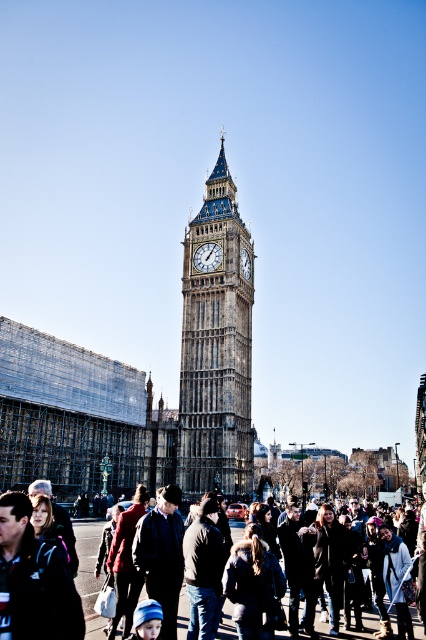
You are a photographer standing in front of the Elizabeth Tower. You want to take a photo that includes both the stone clock tower at center and the dark brown leather jacket at lower center. Which object will appear larger in the photo?

The stone clock tower at center will appear larger in the photo because it has a greater height compared to the dark brown leather jacket at lower center.

You are a photographer standing in front of Big Ben. You want to take a photo that includes both the dark brown leather jacket at lower center and the gold textured clock at center. Which object should you adjust your camera angle to include first if you need to ensure both are fully visible?

The dark brown leather jacket at lower center is wider than the gold textured clock at center, so you should adjust your camera angle to include the dark brown leather jacket at lower center first to ensure both are fully visible.

You are a tourist standing in front of the Elizabeth Tower. You notice the stone clock tower at center and the gold textured clock at center. Which object is located higher in the image?

The gold textured clock at center is higher because the stone clock tower at center is positioned under it.